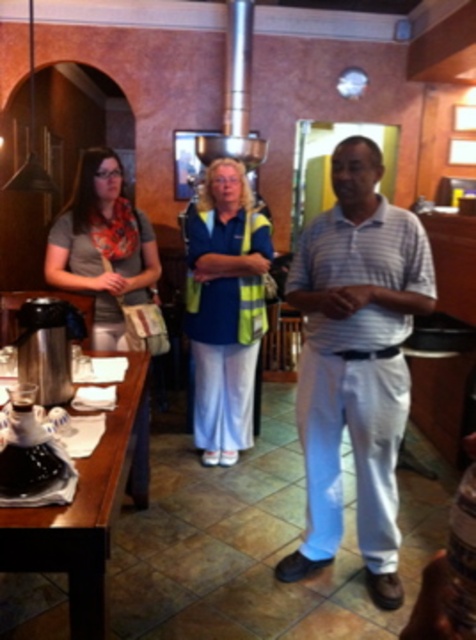
Question: Does white striped polo shirt at center appear over blue reflective vest at center?

Choices:
 (A) no
 (B) yes

Answer: (A)

Question: Can you confirm if brown wood table at lower left is positioned below matte gray scarf at left?

Choices:
 (A) yes
 (B) no

Answer: (A)

Question: In this image, where is blue reflective vest at center located relative to brown wood table at lower left?

Choices:
 (A) below
 (B) above

Answer: (B)

Question: Which of these objects is positioned closest to the white striped polo shirt at center?

Choices:
 (A) blue reflective vest at center
 (B) matte gray scarf at left

Answer: (A)

Question: Considering the real-world distances, which object is closest to the blue reflective vest at center?

Choices:
 (A) brown wood table at lower left
 (B) white striped polo shirt at center
 (C) matte gray scarf at left

Answer: (C)

Question: Which object appears farthest from the camera in this image?

Choices:
 (A) blue reflective vest at center
 (B) white striped polo shirt at center

Answer: (A)